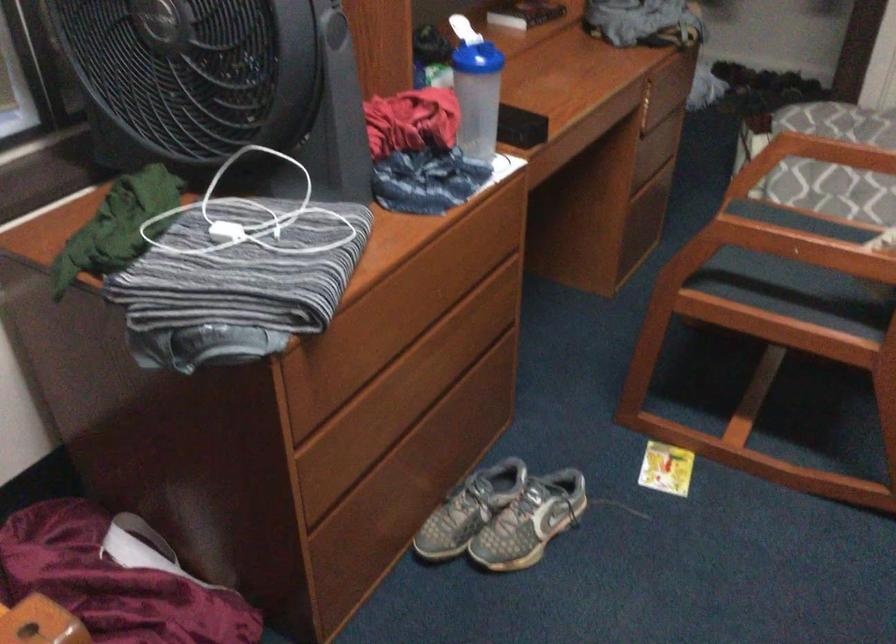
What do you see at coordinates (250, 216) in the screenshot?
I see `a white power adapter` at bounding box center [250, 216].